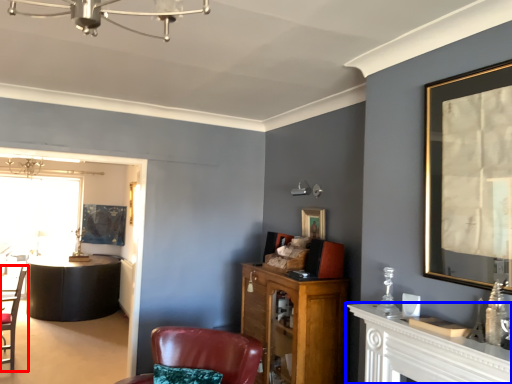
Question: Among these objects, which one is farthest to the camera, chair (highlighted by a red box) or table (highlighted by a blue box)?

Choices:
 (A) chair
 (B) table

Answer: (A)